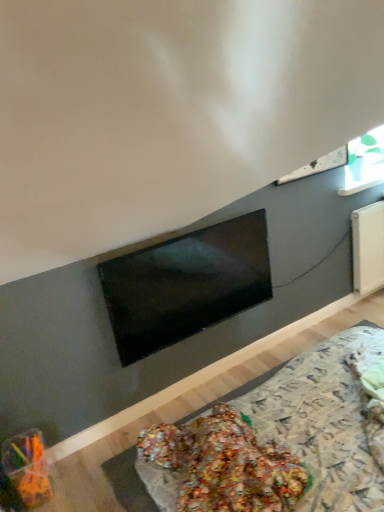
Question: In the image, is translucent plastic container at lower left on the left side or the right side of matte black tv at center?

Choices:
 (A) left
 (B) right

Answer: (A)

Question: Considering their positions, is translucent plastic container at lower left located in front of or behind matte black tv at center?

Choices:
 (A) front
 (B) behind

Answer: (A)

Question: Considering the real-world distances, which object is farthest from the matte black tv at center?

Choices:
 (A) translucent plastic container at lower left
 (B) transparent glass window at upper right

Answer: (B)

Question: Estimate the real-world distances between objects in this image. Which object is farther from the translucent plastic container at lower left?

Choices:
 (A) transparent glass window at upper right
 (B) matte black tv at center

Answer: (A)